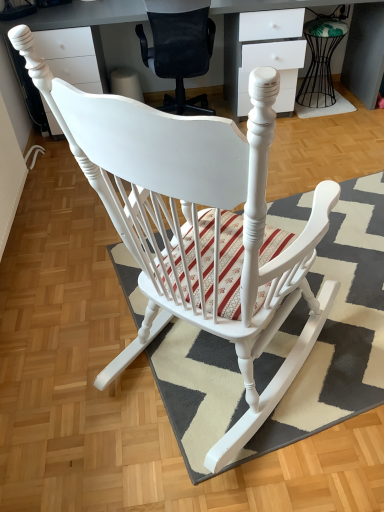
Question: Is white woven mat at lower right, marked as the first doormat in a back-to-front arrangement, bigger than white glossy desk at upper center?

Choices:
 (A) yes
 (B) no

Answer: (B)

Question: Is white woven mat at lower right, arranged as the second doormat when viewed from the front, looking in the opposite direction of white glossy desk at upper center?

Choices:
 (A) yes
 (B) no

Answer: (A)

Question: Is white woven mat at lower right, positioned as the 2th doormat in bottom-to-top order, positioned in front of white glossy desk at upper center?

Choices:
 (A) yes
 (B) no

Answer: (B)

Question: Is white woven mat at lower right, the first doormat positioned from the top, not near white glossy desk at upper center?

Choices:
 (A) no
 (B) yes

Answer: (B)

Question: Could you tell me if white woven mat at lower right, positioned as the 2th doormat in bottom-to-top order, is turned towards white glossy desk at upper center?

Choices:
 (A) yes
 (B) no

Answer: (A)

Question: Considering the positions of point (168, 42) and point (314, 91), is point (168, 42) closer or farther from the camera than point (314, 91)?

Choices:
 (A) closer
 (B) farther

Answer: (A)

Question: Considering the positions of white mesh office chair at center and metallic wire stool at upper right in the image, is white mesh office chair at center taller or shorter than metallic wire stool at upper right?

Choices:
 (A) tall
 (B) short

Answer: (A)

Question: From a real-world perspective, is white mesh office chair at center positioned above or below metallic wire stool at upper right?

Choices:
 (A) below
 (B) above

Answer: (B)

Question: From the image's perspective, is white mesh office chair at center positioned above or below metallic wire stool at upper right?

Choices:
 (A) above
 (B) below

Answer: (B)

Question: In the image, is metallic wire stool at upper right on the left side or the right side of white glossy desk at upper center?

Choices:
 (A) left
 (B) right

Answer: (B)

Question: From a real-world perspective, is metallic wire stool at upper right above or below white glossy desk at upper center?

Choices:
 (A) below
 (B) above

Answer: (A)

Question: Considering their positions, is metallic wire stool at upper right located in front of or behind white glossy desk at upper center?

Choices:
 (A) behind
 (B) front

Answer: (A)

Question: In terms of width, does metallic wire stool at upper right look wider or thinner when compared to white glossy desk at upper center?

Choices:
 (A) thin
 (B) wide

Answer: (A)

Question: Is textured gray rug at center, the second doormat when ordered from top to bottom, wider or thinner than white glossy desk at upper center?

Choices:
 (A) thin
 (B) wide

Answer: (B)

Question: From their relative heights in the image, would you say textured gray rug at center, the second doormat when ordered from top to bottom, is taller or shorter than white glossy desk at upper center?

Choices:
 (A) short
 (B) tall

Answer: (A)